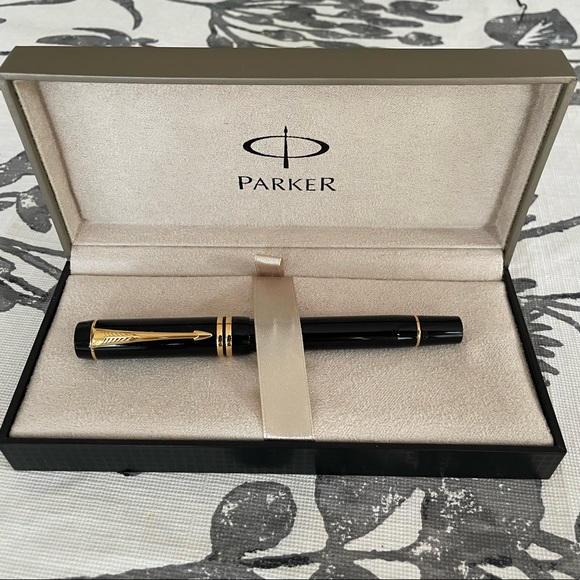
Where is `pen`? pen is located at coordinates (246, 329).